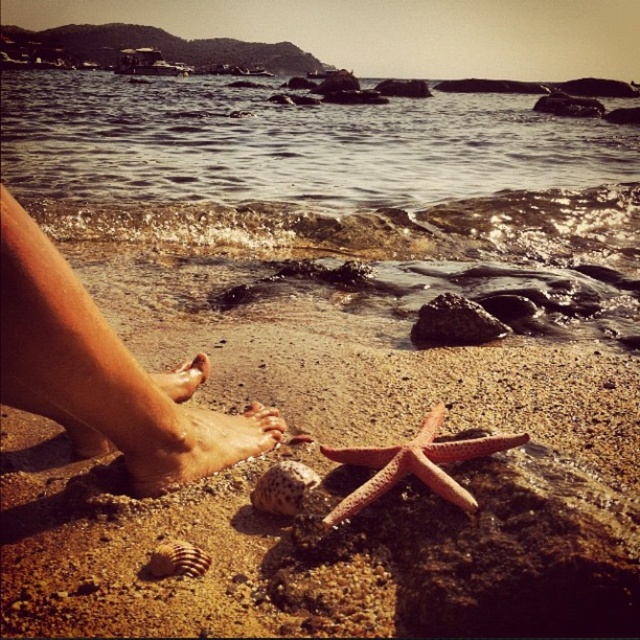
You are a beachcomber searching for treasures on the beach. You notice the dry skin feet at lower left and the speckled shell at lower center. Which object is closer to you, the observer?

The dry skin feet at lower left is positioned over the speckled shell at lower center, meaning the dry skin feet at lower left is closer to you.

You are standing on the beach and see your feet on the sandy shore. There is a point marked at coordinates (x=332, y=193). Based on the scene description, what is located at that point?

The point at coordinates (x=332, y=193) is on clear water at lower center.